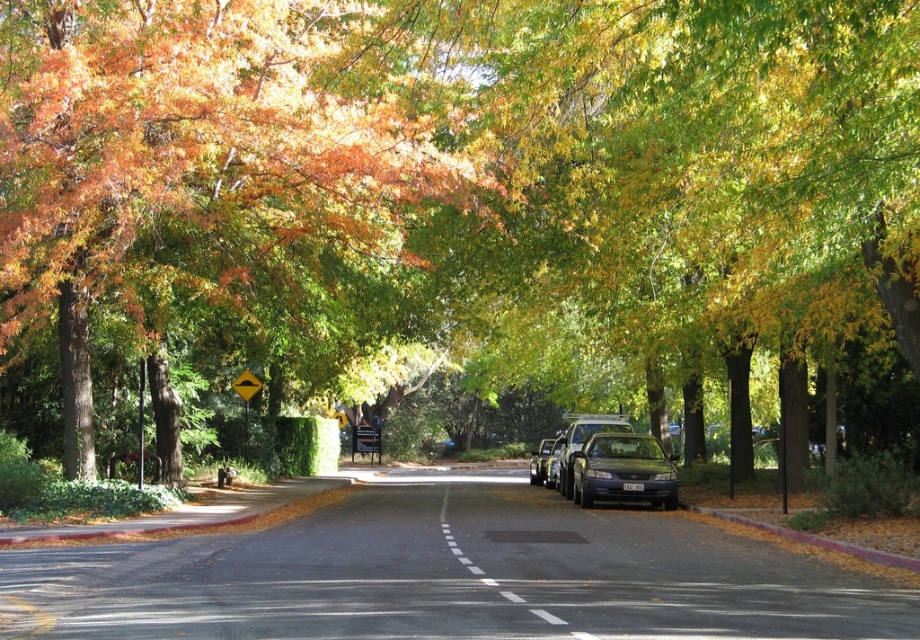
You are a delivery driver who needs to park your delivery van between the metallic gray sedan at center and the shiny black sedan at center. Based on the scene, can you fit your van there?

The metallic gray sedan at center occupies less space than shiny black sedan at center, so there might be enough space between them to park the van, but it depends on the exact dimensions of your van and the distance between the two sedans.

You are a delivery driver who needs to place a 10 cm tall package on the yellow reflective plastic triangle at center without it falling over. Considering the black asphalt road at center is taller than the triangle, will the package stay upright?

The black asphalt road at center is taller than the yellow reflective plastic triangle at center, so placing the 10 cm tall package on the triangle might cause it to tip over since the triangle is lower and possibly unstable compared to the road surface.